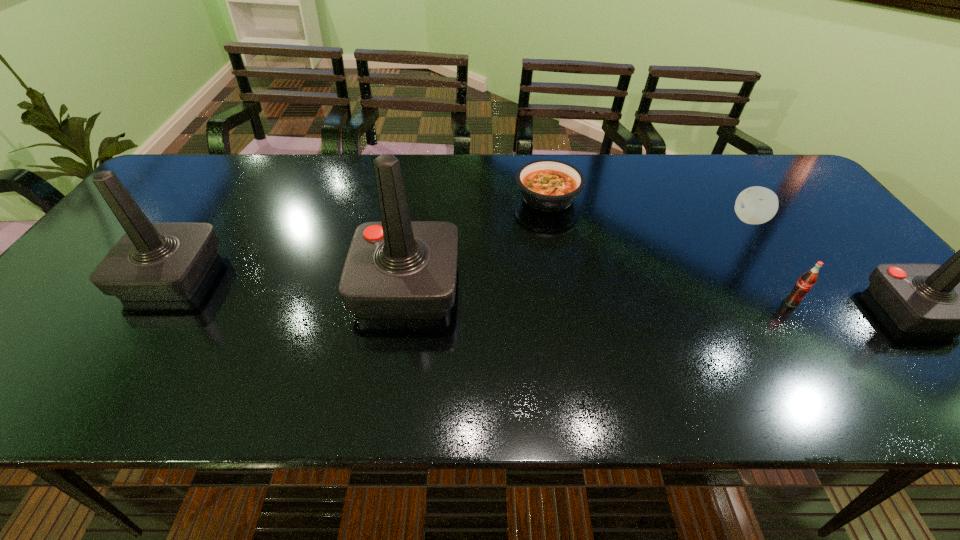
Locate an element on the screen. the leftmost joystick is located at coordinates (168, 261).

Where is `the second tallest object`? the second tallest object is located at coordinates (168, 261).

Locate an element on the screen. The image size is (960, 540). the tallest object is located at coordinates tap(395, 268).

Image resolution: width=960 pixels, height=540 pixels. What are the coordinates of `the second joystick from right to left` in the screenshot? It's located at (395, 268).

Locate an element on the screen. This screenshot has height=540, width=960. apple is located at coordinates (755, 205).

Where is `the fourth tallest object`? the fourth tallest object is located at coordinates (807, 280).

In order to click on the third object from left to right in this screenshot , I will do `click(548, 185)`.

In order to click on the shortest object in this screenshot , I will do `click(548, 185)`.

At what (x,y) coordinates should I click in order to perform the action: click on vacant space located on the front of the second tallest joystick. Please return your answer as a coordinate pair (x, y). Image resolution: width=960 pixels, height=540 pixels. Looking at the image, I should click on (138, 325).

Identify the location of vacant space located on the left of the second object from left to right. tap(263, 286).